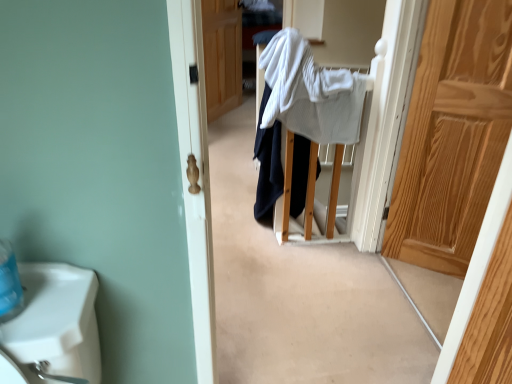
Question: Should I look upward or downward to see white textured bath towel at center?

Choices:
 (A) up
 (B) down

Answer: (A)

Question: Is wooden door at center, the second door from the front, bigger than white cotton sweater at center?

Choices:
 (A) no
 (B) yes

Answer: (A)

Question: Is there a large distance between wooden door at center, the first door positioned from the top, and white cotton sweater at center?

Choices:
 (A) yes
 (B) no

Answer: (A)

Question: From a real-world perspective, is wooden door at center, positioned as the second door in bottom-to-top order, physically below white cotton sweater at center?

Choices:
 (A) no
 (B) yes

Answer: (A)

Question: Does wooden door at center, which appears as the first door when viewed from the back, have a greater width compared to white cotton sweater at center?

Choices:
 (A) no
 (B) yes

Answer: (A)

Question: Is wooden door at center, the first door positioned from the top, completely or partially outside of white cotton sweater at center?

Choices:
 (A) no
 (B) yes

Answer: (B)

Question: From the image's perspective, would you say wooden door at center, which appears as the first door when viewed from the back, is positioned over white cotton sweater at center?

Choices:
 (A) no
 (B) yes

Answer: (B)

Question: Is wooden door at center, which appears as the first door when viewed from the back, at the back of light brown wooden door at right, which is the 2th door in top-to-bottom order?

Choices:
 (A) no
 (B) yes

Answer: (A)

Question: Is light brown wooden door at right, acting as the 2th door starting from the left, wider than wooden door at center, the second door from the front?

Choices:
 (A) yes
 (B) no

Answer: (B)

Question: Does light brown wooden door at right, which appears as the 1th door when ordered from the bottom, have a lesser height compared to wooden door at center, the first door positioned from the top?

Choices:
 (A) yes
 (B) no

Answer: (B)

Question: Does light brown wooden door at right, the first door from the front, touch wooden door at center, positioned as the second door in bottom-to-top order?

Choices:
 (A) yes
 (B) no

Answer: (B)

Question: Is light brown wooden door at right, which is the 2th door in top-to-bottom order, positioned beyond the bounds of wooden door at center, the first door positioned from the top?

Choices:
 (A) no
 (B) yes

Answer: (B)

Question: From a real-world perspective, is light brown wooden door at right, the first door from the front, physically below wooden door at center, the second door viewed from the right?

Choices:
 (A) no
 (B) yes

Answer: (A)

Question: Does white textured bath towel at center have a lesser height compared to white cotton sweater at center?

Choices:
 (A) no
 (B) yes

Answer: (B)